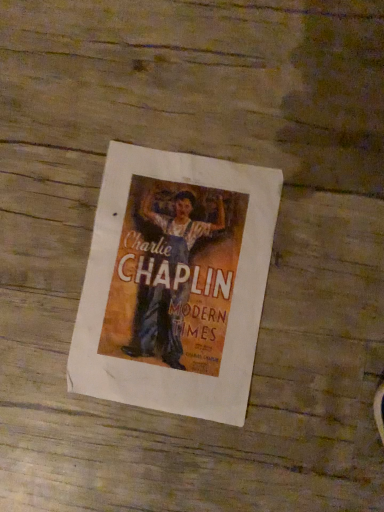
Question: Should I look upward or downward to see matte paper poster at center?

Choices:
 (A) up
 (B) down

Answer: (B)